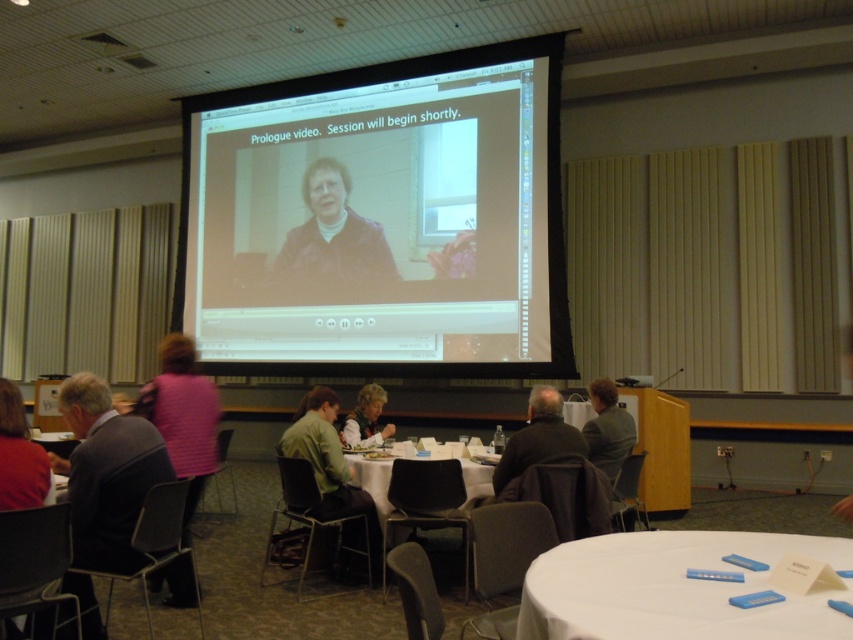
Question: Does white plastic table at lower right have a smaller size compared to dark brown leather jacket at center?

Choices:
 (A) no
 (B) yes

Answer: (A)

Question: Does gray suit jacket at left appear under smooth black hair at center?

Choices:
 (A) no
 (B) yes

Answer: (B)

Question: Which point is closer to the camera?

Choices:
 (A) dark brown leather jacket at center
 (B) gray suit jacket at left

Answer: (B)

Question: Which point is farther to the camera?

Choices:
 (A) white plastic table at lower right
 (B) gray suit jacket at left
 (C) white plastic table at center

Answer: (C)

Question: Is gray suit jacket at left to the right of gray fabric jacket at lower right from the viewer's perspective?

Choices:
 (A) no
 (B) yes

Answer: (A)

Question: Estimate the real-world distances between objects in this image. Which object is closer to the smooth black hair at center?

Choices:
 (A) matte brown jacket at center
 (B) matte red shirt at lower left
 (C) pink textured sweater at lower left
 (D) gray suit jacket at left

Answer: (D)